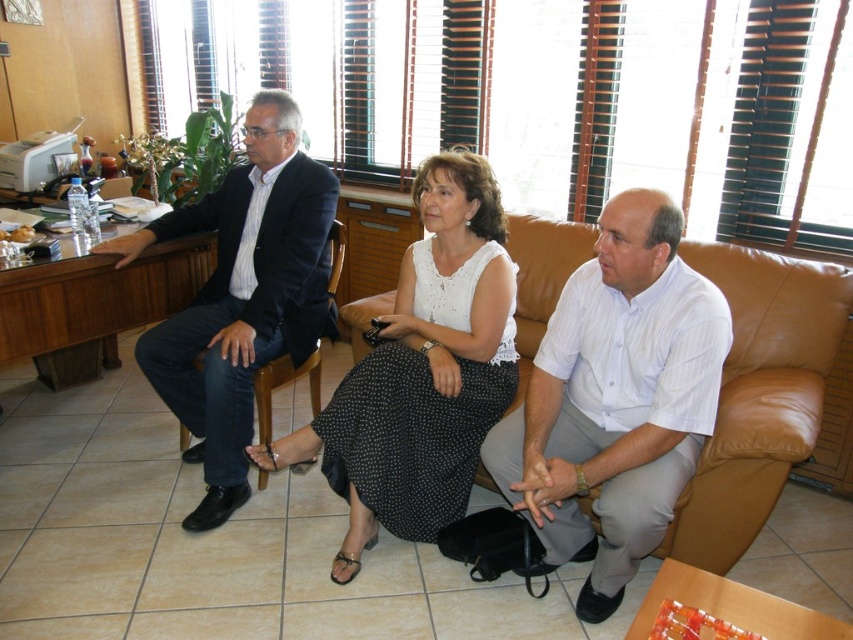
You are an interior designer observing the seating arrangement in the room. You notice the white dotted fabric skirt at center and the black leather armchair at center. Which object is closer to the observer?

The white dotted fabric skirt at center is closer to the observer than the black leather armchair at center because it is positioned in front of it.

You are a guest entering the room and want to sit on the brown leather couch at center. The white dotted fabric skirt at center is blocking your path. Which side should you go around to reach the couch?

The white dotted fabric skirt at center is on the left side of the brown leather couch at center, so you should go around to the right side to reach the couch.

From the picture: You are organizing a small event and need to decide which seating arrangement to use. You have the white dotted fabric skirt at center and the brown leather couch at center. Based on their sizes, which one can accommodate more people sitting together?

The brown leather couch at center can accommodate more people sitting together because it is thicker than the white dotted fabric skirt at center.